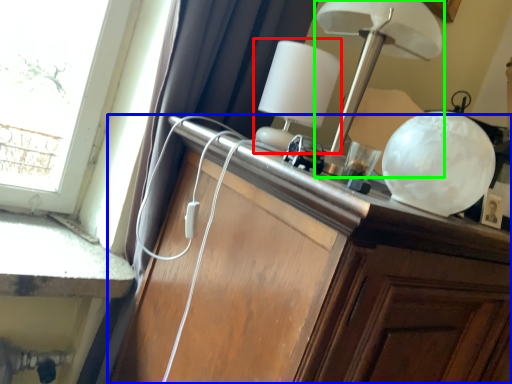
Question: Which is nearer to the table lamp (highlighted by a red box)? cabinetry (highlighted by a blue box) or lamp (highlighted by a green box).

Choices:
 (A) cabinetry
 (B) lamp

Answer: (B)